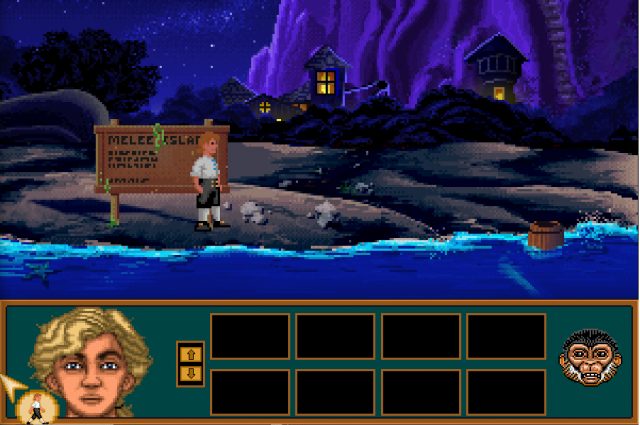
Find the location of a particular element. The image size is (640, 425). window with light shining through is located at coordinates (500, 94), (322, 84), (304, 105), (265, 108), (369, 201).